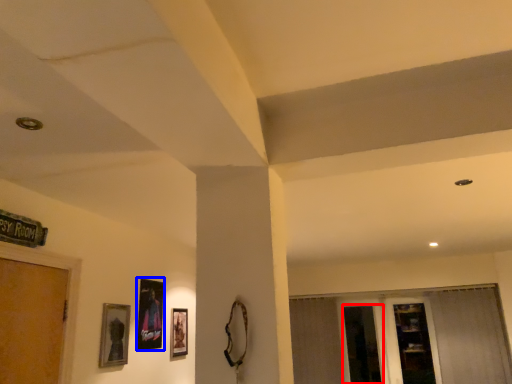
Question: Which point is closer to the camera, screen door (highlighted by a red box) or picture frame (highlighted by a blue box)?

Choices:
 (A) screen door
 (B) picture frame

Answer: (B)